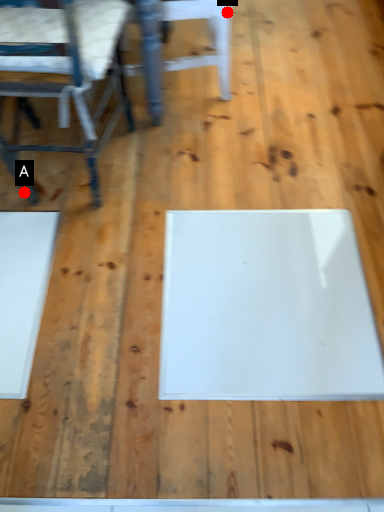
Question: Two points are circled on the image, labeled by A and B beside each circle. Which point is closer to the camera taking this photo?

Choices:
 (A) A is closer
 (B) B is closer

Answer: (A)